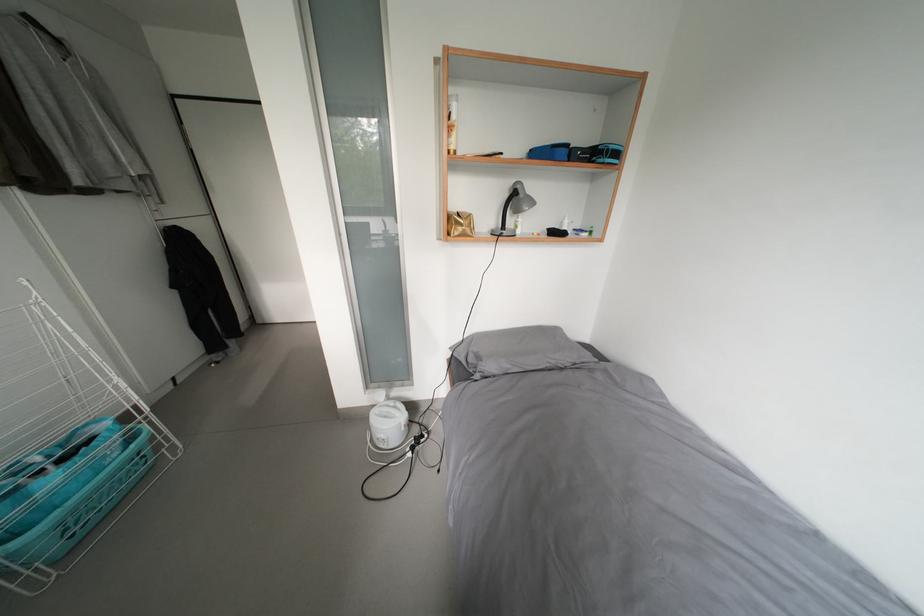
Which object does [73,493] point to?

It corresponds to the blue pencil case in the image.